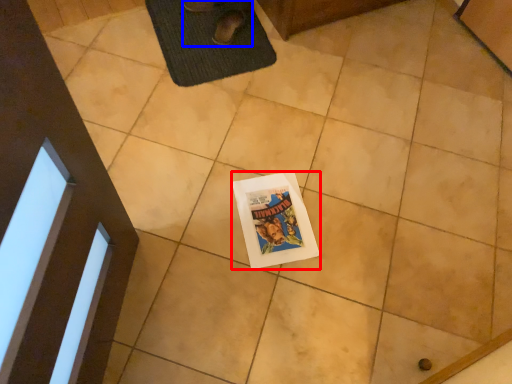
Question: Which object appears farthest to the camera in this image, comic book (highlighted by a red box) or person (highlighted by a blue box)?

Choices:
 (A) comic book
 (B) person

Answer: (B)